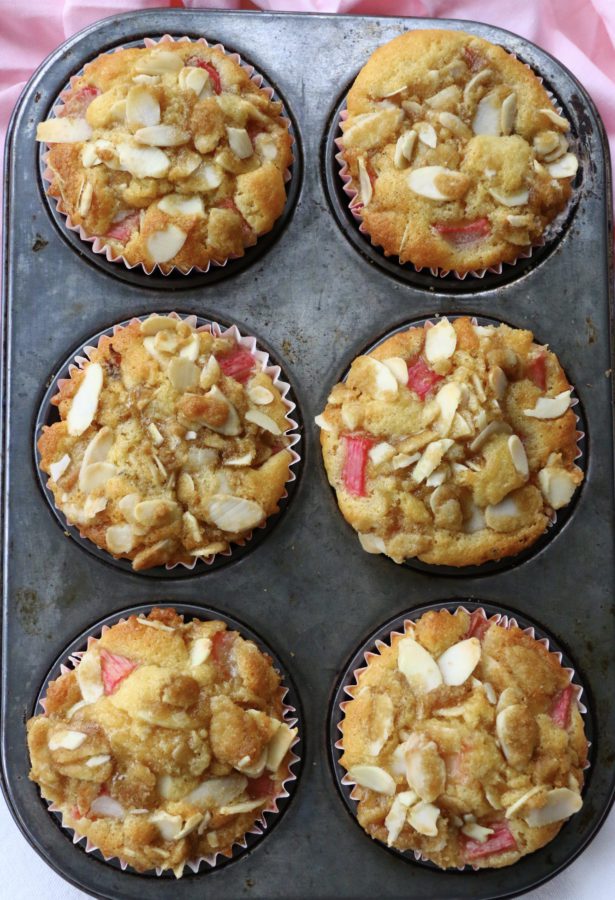
You are a GUI agent. You are given a task and a screenshot of the screen. Output one action in this format:
    pyautogui.click(x=<x>, y=<y>)
    Task: Click on the red and white checkered table cloth
    The height and width of the screenshot is (900, 615).
    Given the screenshot: What is the action you would take?
    pyautogui.click(x=55, y=10)